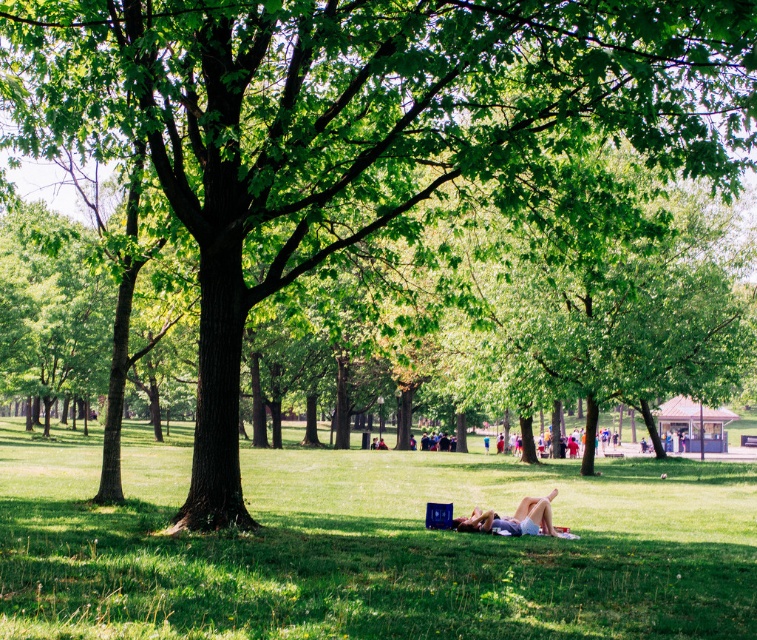
Question: Does green grassy at center have a larger size compared to light blue denim shorts at center?

Choices:
 (A) no
 (B) yes

Answer: (B)

Question: Does green grassy at center appear on the left side of light blue denim shorts at center?

Choices:
 (A) yes
 (B) no

Answer: (B)

Question: Considering the relative positions of green grassy at center and light blue denim shorts at center in the image provided, where is green grassy at center located with respect to light blue denim shorts at center?

Choices:
 (A) left
 (B) right

Answer: (B)

Question: Which of the following is the farthest from the observer?

Choices:
 (A) (215, 620)
 (B) (544, 529)

Answer: (B)